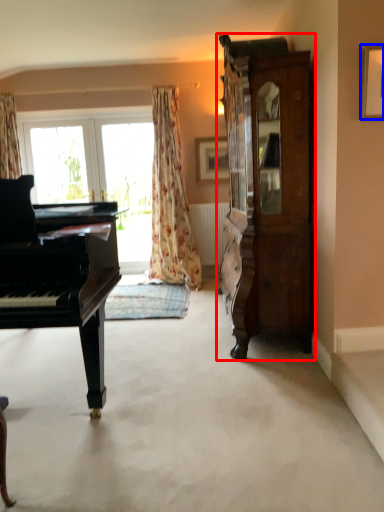
Question: Among these objects, which one is nearest to the camera, cabinetry (highlighted by a red box) or picture frame (highlighted by a blue box)?

Choices:
 (A) cabinetry
 (B) picture frame

Answer: (B)